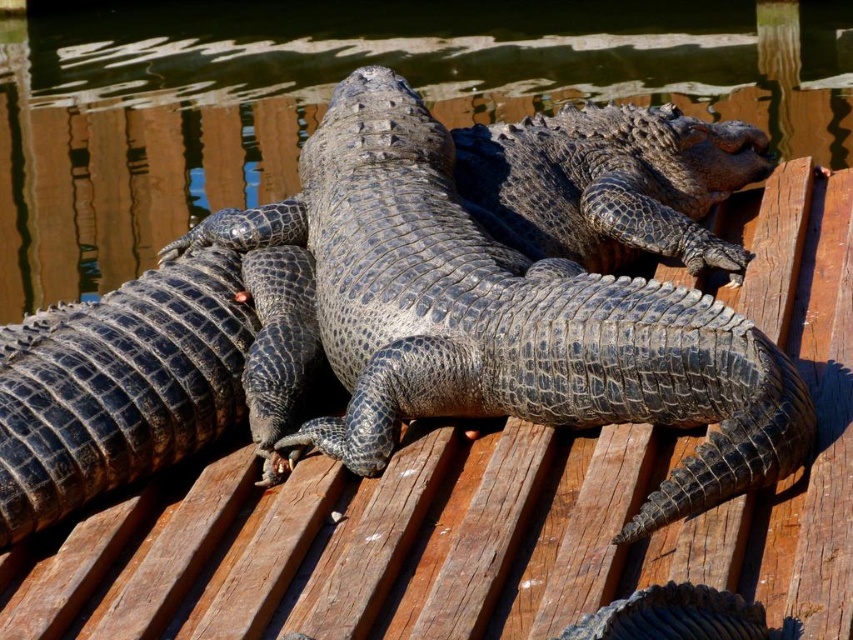
You are a wildlife photographer aiming to capture both the glossy black crocodile at center and the leathery dark gray crocodile at center in a single frame. Given that your camera has a fixed focal length, which crocodile should you position closer to the camera to ensure both fit within the frame?

Since the glossy black crocodile at center is wider than the leathery dark gray crocodile at center, you should position the glossy black crocodile at center closer to the camera to ensure both fit within the frame.

You are standing on the wooden dock and see the point marked at coordinates (x=328, y=93). What creature is located at that point?

The point at coordinates (x=328, y=93) marks the location of the glossy black crocodile at center.

You are a wildlife photographer aiming to capture a clear photo of the glossy black crocodile at center and the leathery dark gray crocodile at center. Which one is positioned higher in the image?

The glossy black crocodile at center is positioned higher than the leathery dark gray crocodile at center because it is above it.